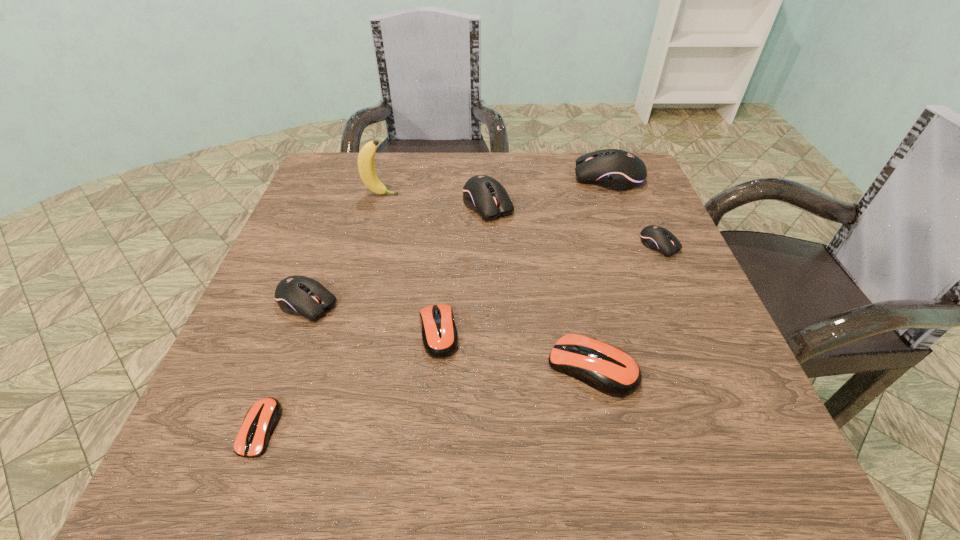
You are a GUI agent. You are given a task and a screenshot of the screen. Output one action in this format:
    pyautogui.click(x=<x>, y=<y>)
    Task: Click on the banana
    Image resolution: width=960 pixels, height=540 pixels.
    Given the screenshot: What is the action you would take?
    pyautogui.click(x=366, y=167)

Find the location of a particular element. The width and height of the screenshot is (960, 540). the seventh shortest object is located at coordinates (615, 169).

Identify the location of the tallest computer mouse. (615, 169).

The image size is (960, 540). Find the location of `the third smallest black computer mouse`. the third smallest black computer mouse is located at coordinates (483, 194).

Identify the location of the third tallest object. (483, 194).

Find the location of a particular element. the nearest black computer mouse is located at coordinates (298, 295).

This screenshot has height=540, width=960. Find the location of `the leftmost black computer mouse`. the leftmost black computer mouse is located at coordinates (298, 295).

Find the location of a particular element. The image size is (960, 540). the biggest orange computer mouse is located at coordinates (606, 368).

Identify the location of the fourth farthest object. Image resolution: width=960 pixels, height=540 pixels. (657, 238).

This screenshot has height=540, width=960. I want to click on the fifth nearest computer mouse, so (657, 238).